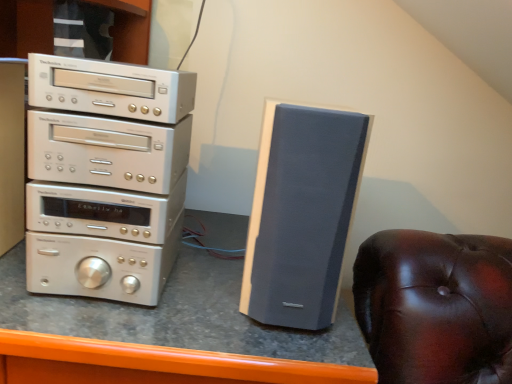
I want to click on vacant space in front of silver metallic stereo stack at left, so click(91, 325).